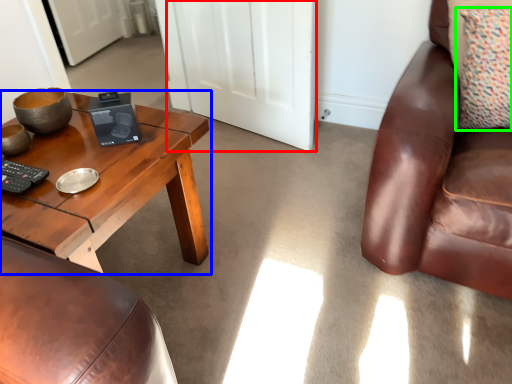
Question: Estimate the real-world distances between objects in this image. Which object is farther from door (highlighted by a red box), coffee table (highlighted by a blue box) or pillow (highlighted by a green box)?

Choices:
 (A) coffee table
 (B) pillow

Answer: (B)